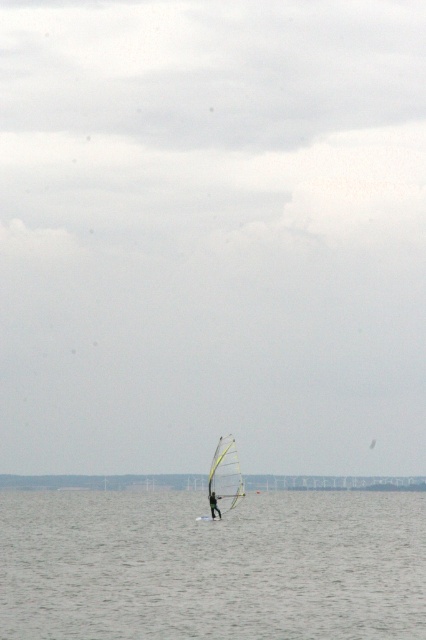
You are a photographer trying to capture the white matte sail at center and the clear water at center in a single shot. Based on the scene, can you determine which object is closer to the camera?

The clear water at center is in front of the white matte sail at center, so the clear water at center is closer to the camera.